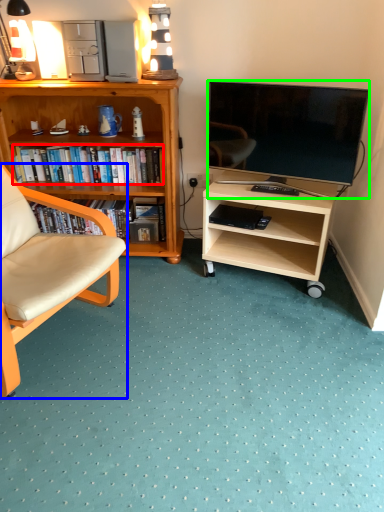
Question: Estimate the real-world distances between objects in this image. Which object is farther from book (highlighted by a red box), chair (highlighted by a blue box) or television (highlighted by a green box)?

Choices:
 (A) chair
 (B) television

Answer: (A)